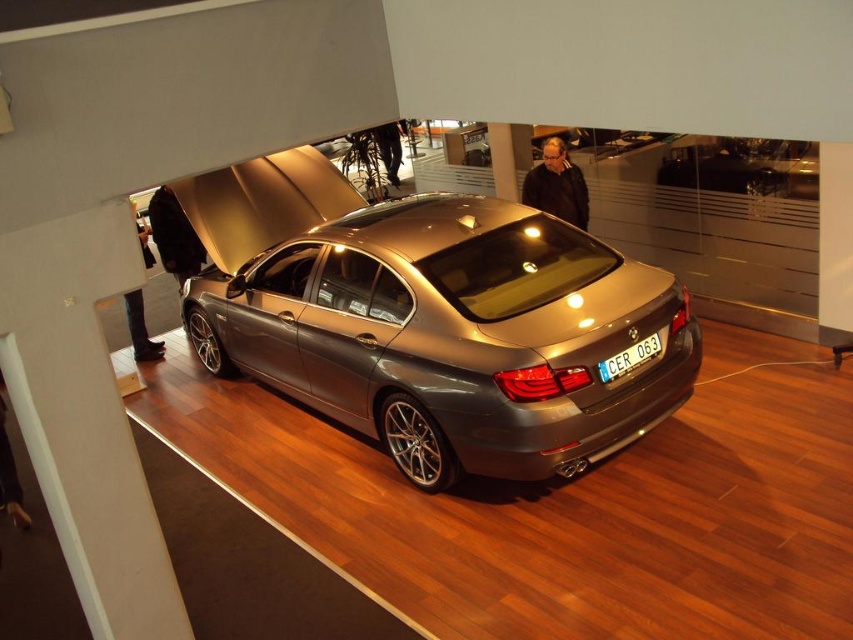
You are a customer at the BMW showroom and see the black leather jacket at upper center and the white plastic license plate at rear. Which object is closer to the left side of the image?

The black leather jacket at upper center is closer to the left side of the image because it is positioned to the left of the white plastic license plate at rear.